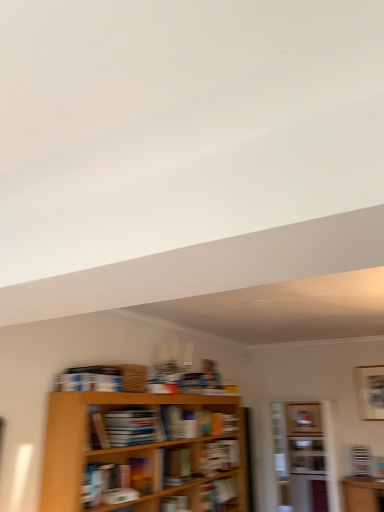
Question: Relative to matte black bookshelf at lower right, which appears as the 6th book when viewed from the front, is white glossy cabinet at center in front or behind?

Choices:
 (A) behind
 (B) front

Answer: (A)

Question: Visually, is white glossy cabinet at center positioned to the left or to the right of matte black bookshelf at lower right, which appears as the 6th book when viewed from the front?

Choices:
 (A) left
 (B) right

Answer: (A)

Question: Which object is the farthest from the hardcover book at center, which ranks as the 2th book in right-to-left order?

Choices:
 (A) white glossy cabinet at center
 (B) wooden bookshelf at center
 (C) matte brown book at center, which ranks as the 4th book in back-to-front order
 (D) white matte bookshelf at center, the 5th book in the front-to-back sequence
 (E) matte black bookshelf at lower right, which is counted as the sixth book, starting from the left

Answer: (E)

Question: Considering the real-world distances, which object is farthest from the white matte bookshelf at center, the 5th book in the front-to-back sequence?

Choices:
 (A) hardcover book at center, which ranks as the 2th book in right-to-left order
 (B) matte black bookshelf at lower right, the first book from the back
 (C) matte brown book at center, which appears as the third book when viewed from the front
 (D) wooden bookshelf at center
 (E) white glossy cabinet at center

Answer: (B)